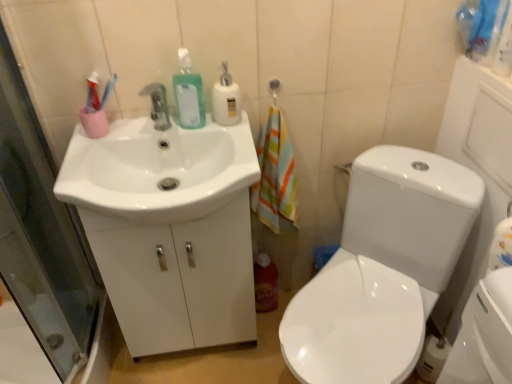
Question: Does white glossy toilet at right have a lesser height compared to matte silver faucet at center?

Choices:
 (A) no
 (B) yes

Answer: (A)

Question: From a real-world perspective, is white glossy toilet at right under matte silver faucet at center?

Choices:
 (A) yes
 (B) no

Answer: (A)

Question: From the image's perspective, is white glossy toilet at right beneath matte silver faucet at center?

Choices:
 (A) no
 (B) yes

Answer: (B)

Question: Is white glossy toilet at right positioned before matte silver faucet at center?

Choices:
 (A) no
 (B) yes

Answer: (B)

Question: Is white glossy toilet at right facing away from matte silver faucet at center?

Choices:
 (A) yes
 (B) no

Answer: (B)

Question: From a real-world perspective, is green matte liquid soap at upper center, which is the first cleaning product from front to back, physically located above or below white glossy toilet at right?

Choices:
 (A) below
 (B) above

Answer: (B)

Question: Considering the positions of green matte liquid soap at upper center, the third cleaning product in the bottom-to-top sequence, and white glossy toilet at right in the image, is green matte liquid soap at upper center, the third cleaning product in the bottom-to-top sequence, wider or thinner than white glossy toilet at right?

Choices:
 (A) thin
 (B) wide

Answer: (A)

Question: In the image, is green matte liquid soap at upper center, the third cleaning product in the right-to-left sequence, positioned in front of or behind white glossy toilet at right?

Choices:
 (A) behind
 (B) front

Answer: (A)

Question: Considering the relative positions of green matte liquid soap at upper center, the 1th cleaning product positioned from the left, and white glossy toilet at right in the image provided, is green matte liquid soap at upper center, the 1th cleaning product positioned from the left, to the left or to the right of white glossy toilet at right?

Choices:
 (A) right
 (B) left

Answer: (B)

Question: Is white glossy toilet at right to the left or to the right of white glossy sink at left in the image?

Choices:
 (A) right
 (B) left

Answer: (A)

Question: In terms of width, does white glossy toilet at right look wider or thinner when compared to white glossy sink at left?

Choices:
 (A) thin
 (B) wide

Answer: (B)

Question: From a real-world perspective, is white glossy toilet at right above or below white glossy sink at left?

Choices:
 (A) above
 (B) below

Answer: (B)

Question: Is white glossy toilet at right inside or outside of white glossy sink at left?

Choices:
 (A) inside
 (B) outside

Answer: (B)

Question: Is white glossy toilet at right to the left or to the right of white glossy soap dispenser at upper center, positioned as the 2th cleaning product in front-to-back order, in the image?

Choices:
 (A) right
 (B) left

Answer: (A)

Question: Considering the positions of white glossy toilet at right and white glossy soap dispenser at upper center, the second cleaning product when ordered from left to right, in the image, is white glossy toilet at right taller or shorter than white glossy soap dispenser at upper center, the second cleaning product when ordered from left to right,?

Choices:
 (A) tall
 (B) short

Answer: (A)